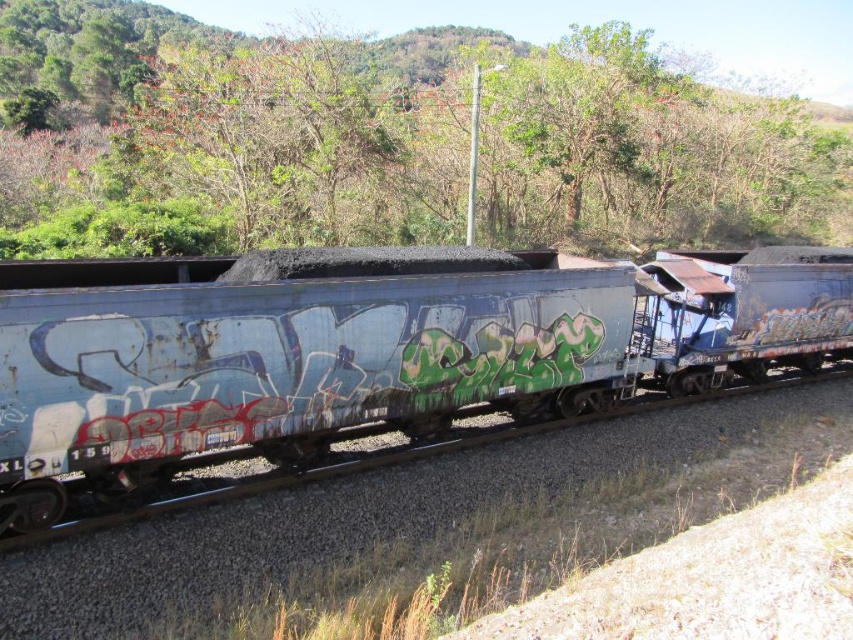
Question: Which of the following is the farthest from the observer?

Choices:
 (A) rusty metal train car at center
 (B) green leafy tree at upper center

Answer: (B)

Question: Does green leafy tree at upper center appear on the left side of rusty metal train car at center?

Choices:
 (A) yes
 (B) no

Answer: (A)

Question: Observing the image, what is the correct spatial positioning of green leafy tree at upper center in reference to rusty metal train car at center?

Choices:
 (A) left
 (B) right

Answer: (A)

Question: Among these objects, which one is farthest from the camera?

Choices:
 (A) rusty metal train car at center
 (B) green leafy tree at upper center

Answer: (B)

Question: Is green leafy tree at upper center further to the viewer compared to rusty metal train car at center?

Choices:
 (A) yes
 (B) no

Answer: (A)